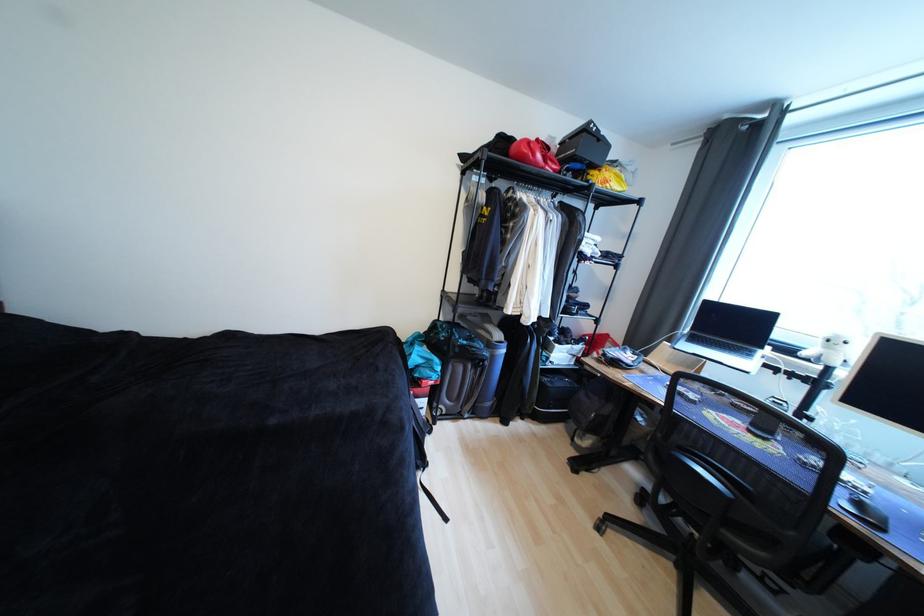
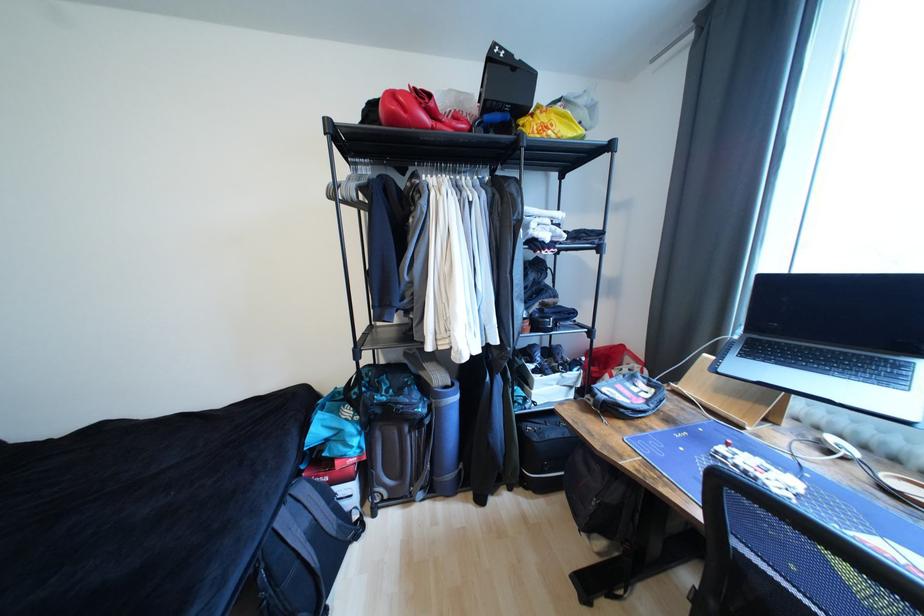
Which direction would the cameraman need to move to produce the second image?

The cameraman walked toward right, forward.